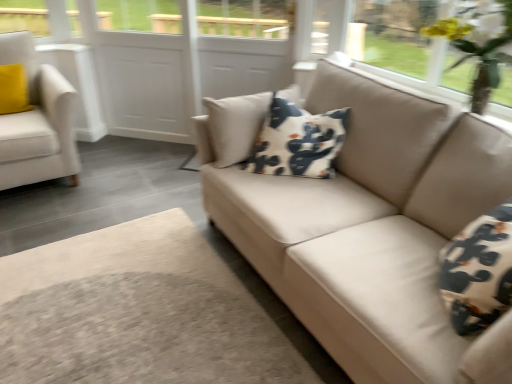
Question: Is white matte screen door at center aimed at beige fabric couch at center?

Choices:
 (A) yes
 (B) no

Answer: (A)

Question: Is white matte screen door at center facing away from beige fabric couch at center?

Choices:
 (A) yes
 (B) no

Answer: (B)

Question: Can we say white matte screen door at center lies outside beige fabric couch at center?

Choices:
 (A) no
 (B) yes

Answer: (B)

Question: Can you confirm if white matte screen door at center is thinner than beige fabric couch at center?

Choices:
 (A) yes
 (B) no

Answer: (A)

Question: Does white matte screen door at center have a larger size compared to beige fabric couch at center?

Choices:
 (A) no
 (B) yes

Answer: (A)

Question: Is white matte screen door at center far away from beige fabric couch at center?

Choices:
 (A) no
 (B) yes

Answer: (B)

Question: Is white fabric armchair at left wider than beige fabric couch at center?

Choices:
 (A) yes
 (B) no

Answer: (B)

Question: From the image's perspective, is white fabric armchair at left located above beige fabric couch at center?

Choices:
 (A) no
 (B) yes

Answer: (B)

Question: Is beige fabric couch at center a part of white fabric armchair at left?

Choices:
 (A) no
 (B) yes

Answer: (A)

Question: Can you confirm if white fabric armchair at left is taller than beige fabric couch at center?

Choices:
 (A) yes
 (B) no

Answer: (A)

Question: Is white fabric armchair at left with beige fabric couch at center?

Choices:
 (A) no
 (B) yes

Answer: (A)

Question: Does white fabric armchair at left come in front of beige fabric couch at center?

Choices:
 (A) yes
 (B) no

Answer: (B)

Question: Does yellow artificial flowers at upper right appear on the right side of white fabric armchair at left?

Choices:
 (A) no
 (B) yes

Answer: (B)